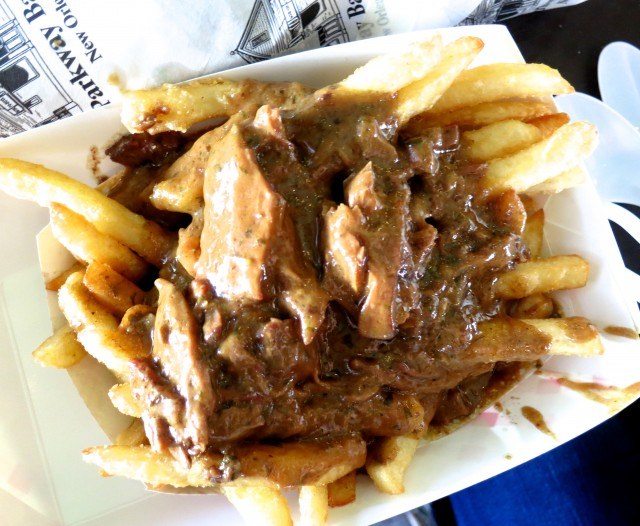
You are a GUI agent. You are given a task and a screenshot of the screen. Output one action in this format:
    pyautogui.click(x=<x>, y=<y>)
    Task: Click on the basket
    This screenshot has width=640, height=526.
    Given the screenshot: What is the action you would take?
    pyautogui.click(x=564, y=428)